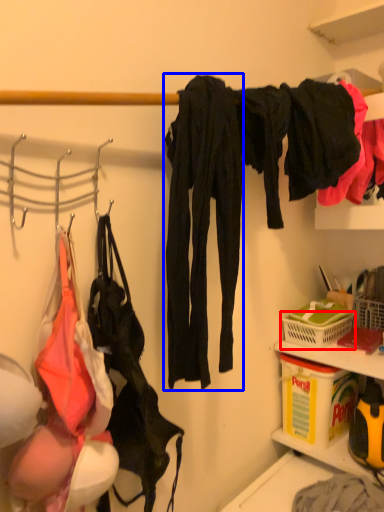
Question: Which object is closer to the camera taking this photo, basket (highlighted by a red box) or clothing (highlighted by a blue box)?

Choices:
 (A) basket
 (B) clothing

Answer: (B)